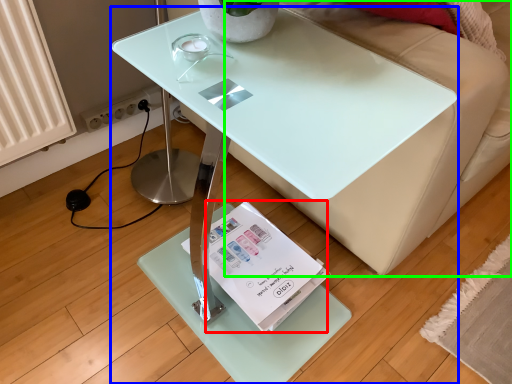
Question: Which object is the farthest from magazine (highlighted by a red box)? Choose among these: table (highlighted by a blue box) or couch (highlighted by a green box).

Choices:
 (A) table
 (B) couch

Answer: (B)